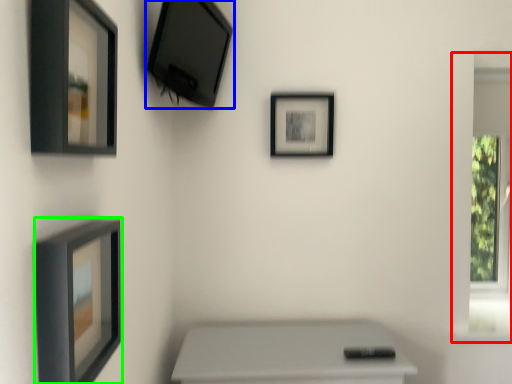
Question: Which object is positioned farthest from window frame (highlighted by a red box)? Select from picture frame (highlighted by a blue box) and picture frame (highlighted by a green box).

Choices:
 (A) picture frame
 (B) picture frame

Answer: (B)